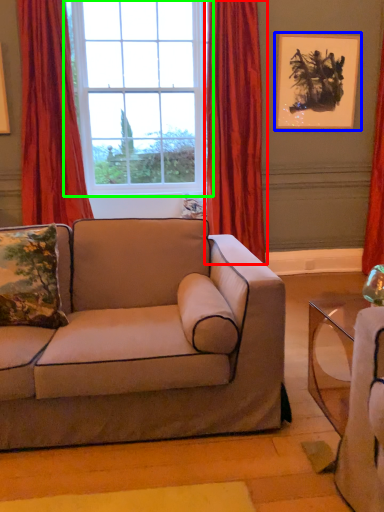
Question: Estimate the real-world distances between objects in this image. Which object is closer to curtain (highlighted by a red box), picture frame (highlighted by a blue box) or window (highlighted by a green box)?

Choices:
 (A) picture frame
 (B) window

Answer: (A)